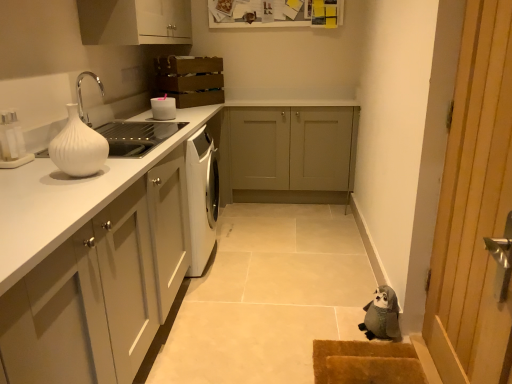
Describe the element at coordinates (366, 363) in the screenshot. This screenshot has width=512, height=384. I see `brown textured mat at lower right` at that location.

The width and height of the screenshot is (512, 384). Identify the location of white glossy bowl at upper left. (163, 108).

Which is behind, point (164, 97) or point (98, 21)?

The point (164, 97) is behind.

Is white glossy bowl at upper left inside the boundaries of white matte cabinet at upper center, which is the 2th cabinetry from front to back, or outside?

white glossy bowl at upper left lies outside white matte cabinet at upper center, which is the 2th cabinetry from front to back.

In the image, is white glossy bowl at upper left positioned in front of or behind white matte cabinet at upper center, the 1th cabinetry when ordered from top to bottom?

white glossy bowl at upper left is behind white matte cabinet at upper center, the 1th cabinetry when ordered from top to bottom.

Consider the image. Which of these two, white glossy bowl at upper left or white matte cabinet at upper center, which is the 2th cabinetry from front to back, is bigger?

Bigger between the two is white matte cabinet at upper center, which is the 2th cabinetry from front to back.

The width and height of the screenshot is (512, 384). Identify the location of animal that appears below the white glossy bowl at upper left (from a real-world perspective). (382, 315).

Would you say gray fabric stuffed animal at lower right is outside white glossy bowl at upper left?

That's correct, gray fabric stuffed animal at lower right is outside of white glossy bowl at upper left.

In the scene shown: Is gray fabric stuffed animal at lower right taller than white glossy bowl at upper left?

Correct, gray fabric stuffed animal at lower right is much taller as white glossy bowl at upper left.

Does gray fabric stuffed animal at lower right touch white glossy bowl at upper left?

gray fabric stuffed animal at lower right is not next to white glossy bowl at upper left, and they're not touching.

How distant is white matte cabinet at upper center, acting as the 3th cabinetry starting from the bottom, from white glossy vase at left?

They are 4.07 feet apart.

Is white matte cabinet at upper center, which is the 2th cabinetry from front to back, situated inside white glossy vase at left or outside?

white matte cabinet at upper center, which is the 2th cabinetry from front to back, is spatially situated outside white glossy vase at left.

Can you tell me how much white matte cabinet at upper center, which is the 2th cabinetry from front to back, and white glossy vase at left differ in facing direction?

0.169 degrees separate the facing orientations of white matte cabinet at upper center, which is the 2th cabinetry from front to back, and white glossy vase at left.

Does point (128, 28) come farther from viewer compared to point (86, 166)?

Yes, point (128, 28) is farther from viewer.

Which object is closer to the camera, white glossy bowl at upper left or white glossy vase at left?

white glossy vase at left.

Considering the relative sizes of white glossy bowl at upper left and white glossy vase at left in the image provided, is white glossy bowl at upper left bigger than white glossy vase at left?

Incorrect, white glossy bowl at upper left is not larger than white glossy vase at left.

Measure the distance from white glossy bowl at upper left to white glossy vase at left.

white glossy bowl at upper left and white glossy vase at left are 1.13 meters apart.

From the picture: Is white glossy bowl at upper left placed right next to white glossy vase at left?

white glossy bowl at upper left and white glossy vase at left are not in contact.

Is gray fabric stuffed animal at lower right placed right next to white matte cabinet at upper center, acting as the 3th cabinetry starting from the bottom?

There is a gap between gray fabric stuffed animal at lower right and white matte cabinet at upper center, acting as the 3th cabinetry starting from the bottom.

Does gray fabric stuffed animal at lower right have a greater width compared to white matte cabinet at upper center, which is the 2th cabinetry from front to back?

No, gray fabric stuffed animal at lower right is not wider than white matte cabinet at upper center, which is the 2th cabinetry from front to back.

Is gray fabric stuffed animal at lower right facing towards white matte cabinet at upper center, the second cabinetry in the back-to-front sequence?

No, gray fabric stuffed animal at lower right is not facing towards white matte cabinet at upper center, the second cabinetry in the back-to-front sequence.

From the image's perspective, would you say gray fabric stuffed animal at lower right is shown under white matte cabinet at upper center, the second cabinetry in the back-to-front sequence?

Yes.

In terms of height, does wooden door at right look taller or shorter compared to white glossy countertop at left?

Clearly, wooden door at right is taller compared to white glossy countertop at left.

From a real-world perspective, which is physically below, wooden door at right or white glossy countertop at left?

white glossy countertop at left is physically lower.

Does wooden door at right lie in front of white glossy countertop at left?

That is True.

From a real-world perspective, between white glossy vase at left and white glossy countertop at left, who is vertically lower?

white glossy countertop at left is physically lower.

Considering the sizes of white glossy vase at left and white glossy countertop at left in the image, is white glossy vase at left taller or shorter than white glossy countertop at left?

In the image, white glossy vase at left appears to be shorter than white glossy countertop at left.

Consider the image. Based on their positions, is white glossy vase at left located to the left or right of white glossy countertop at left?

From the image, it's evident that white glossy vase at left is to the left of white glossy countertop at left.

Starting from the white glossy bowl at upper left, which cabinetry is the 1st one in front? Please provide its 2D coordinates.

[(135, 22)]

You are a GUI agent. You are given a task and a screenshot of the screen. Output one action in this format:
    pyautogui.click(x=<x>, y=<y>)
    Task: Click on the appliance behind the gray fabric stuffed animal at lower right
    The height and width of the screenshot is (384, 512).
    Given the screenshot: What is the action you would take?
    pyautogui.click(x=163, y=108)

Which object lies nearer to the anchor point white matte cabinet at upper center, the second cabinetry in the back-to-front sequence, matte white cabinets at left, arranged as the third cabinetry when viewed from the top, or white glossy countertop at left?

white glossy countertop at left is positioned closer to the anchor white matte cabinet at upper center, the second cabinetry in the back-to-front sequence.

Based on their spatial positions, is white matte cabinet at upper center, the second cabinetry in the back-to-front sequence, or matte gray cabinet at center, the 3th cabinetry positioned from the front, closer to brown textured mat at lower right?

Based on the image, matte gray cabinet at center, the 3th cabinetry positioned from the front, appears to be nearer to brown textured mat at lower right.

Based on their spatial positions, is wooden door at right or matte gray cabinet at center, the first cabinetry viewed from the back, further from gray fabric stuffed animal at lower right?

Among the two, matte gray cabinet at center, the first cabinetry viewed from the back, is located further to gray fabric stuffed animal at lower right.

Looking at the image, which one is located further to white glossy vase at left, matte white cabinets at left, which is counted as the 1th cabinetry, starting from the bottom, or gray fabric stuffed animal at lower right?

Among the two, gray fabric stuffed animal at lower right is located further to white glossy vase at left.

When comparing their distances from wooden door at right, does brown textured mat at lower right or white matte cabinet at upper center, which is the 2th cabinetry from front to back, seem closer?

The object closer to wooden door at right is brown textured mat at lower right.

Consider the image. Based on their spatial positions, is matte gray cabinet at center, which is the 2th cabinetry from bottom to top, or wooden door at right further from white glossy countertop at left?

matte gray cabinet at center, which is the 2th cabinetry from bottom to top, lies further to white glossy countertop at left than the other object.

Looking at the image, which one is located closer to matte white cabinets at left, arranged as the third cabinetry when viewed from the top, white glossy bowl at upper left or brown textured mat at lower right?

brown textured mat at lower right lies closer to matte white cabinets at left, arranged as the third cabinetry when viewed from the top, than the other object.

In the scene shown: Looking at the image, which one is located closer to white glossy countertop at left, matte white cabinets at left, the third cabinetry viewed from the back, or white glossy vase at left?

Among the two, white glossy vase at left is located nearer to white glossy countertop at left.

The image size is (512, 384). In order to click on vase between matte white cabinets at left, which is counted as the 1th cabinetry, starting from the bottom, and white glossy bowl at upper left in the front-back direction in this screenshot , I will do `click(78, 147)`.

Image resolution: width=512 pixels, height=384 pixels. I want to click on vase between white matte cabinet at upper center, the 1th cabinetry when ordered from top to bottom, and wooden door at right from left to right, so click(78, 147).

Identify the location of countertop between white glossy vase at left and gray fabric stuffed animal at lower right. The width and height of the screenshot is (512, 384). (67, 199).

I want to click on animal between white glossy vase at left and matte gray cabinet at center, the second cabinetry when ordered from top to bottom, in the front-back direction, so click(x=382, y=315).